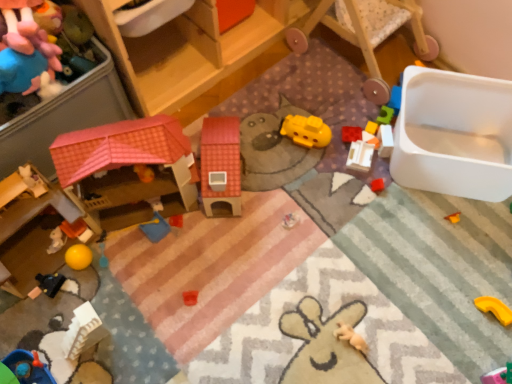
Image resolution: width=512 pixels, height=384 pixels. I want to click on vacant space that is in between yellow rubber toy at lower right, positioned as the 11th toy in left-to-right order, and rubber brick at upper right, which appears as the fifth toy when viewed from the right, so tap(428, 232).